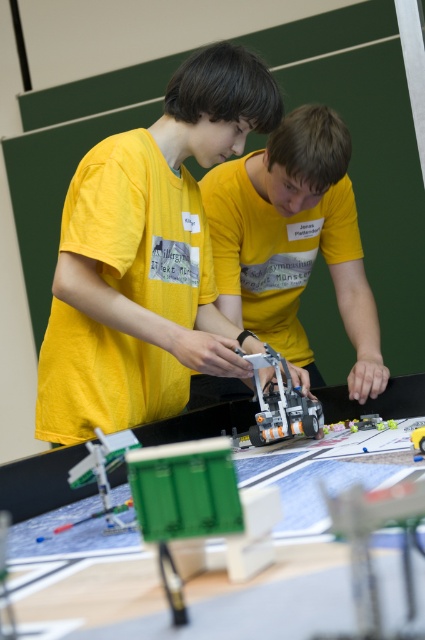
Question: Which of these objects is positioned farthest from the matte yellow shirt at center?

Choices:
 (A) translucent orange plastic robot at center
 (B) yellow matte shirt at center

Answer: (B)

Question: Which object is farther from the camera taking this photo?

Choices:
 (A) matte yellow shirt at center
 (B) translucent orange plastic robot at center
 (C) yellow matte shirt at center

Answer: (C)

Question: Does matte yellow shirt at center appear under translucent orange plastic robot at center?

Choices:
 (A) yes
 (B) no

Answer: (B)

Question: Which point appears closest to the camera in this image?

Choices:
 (A) (295, 189)
 (B) (198, 300)

Answer: (A)

Question: Is the position of matte yellow shirt at center more distant than that of translucent orange plastic robot at center?

Choices:
 (A) no
 (B) yes

Answer: (A)

Question: Can you confirm if yellow matte shirt at center is wider than translucent orange plastic robot at center?

Choices:
 (A) no
 (B) yes

Answer: (B)